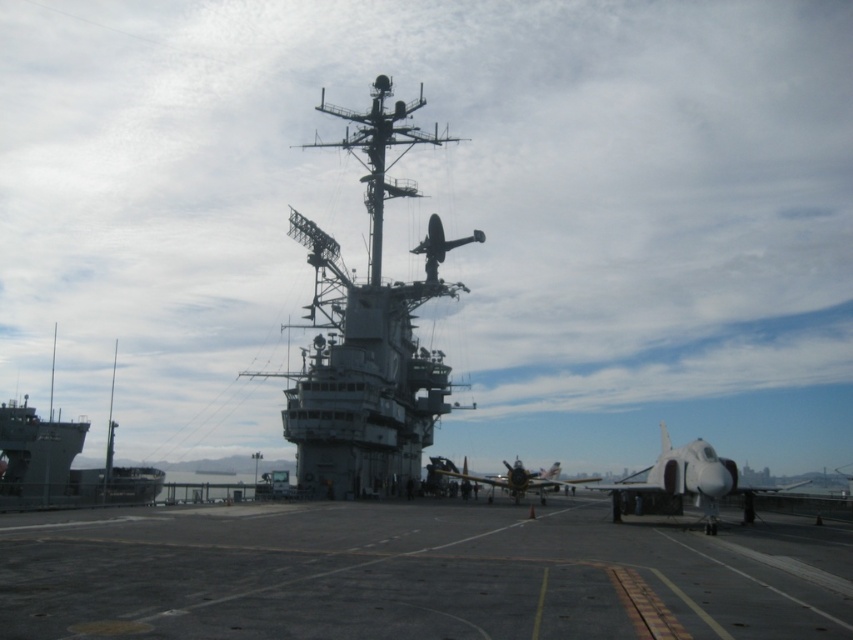
Question: Which of the following is the farthest from the observer?

Choices:
 (A) (1, 486)
 (B) (386, 417)
 (C) (514, 499)
 (D) (751, 504)

Answer: (C)

Question: Which point appears farthest from the camera in this image?

Choices:
 (A) tap(714, 451)
 (B) tap(523, 476)
 (C) tap(10, 440)
 (D) tap(396, 452)

Answer: (C)

Question: Can you confirm if gray metallic ship at left is bigger than yellow matte airplane at center?

Choices:
 (A) no
 (B) yes

Answer: (B)

Question: Can you confirm if gray metallic ship at left is smaller than white glossy jet at center?

Choices:
 (A) yes
 (B) no

Answer: (A)

Question: Which of the following is the farthest from the observer?

Choices:
 (A) (618, 509)
 (B) (82, 497)
 (C) (401, 400)
 (D) (518, 460)

Answer: (D)

Question: Does white glossy jet at center have a larger size compared to yellow matte airplane at center?

Choices:
 (A) yes
 (B) no

Answer: (A)